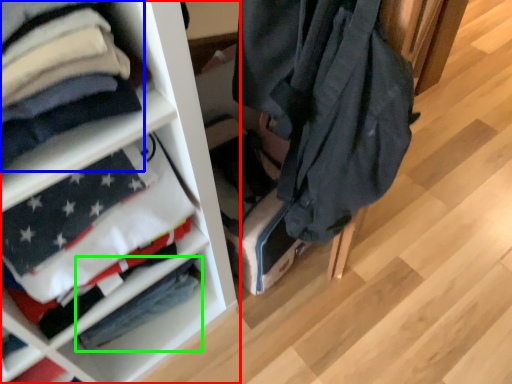
Question: Considering the real-world distances, which object is closest to shelf (highlighted by a red box)? cloak (highlighted by a blue box) or flag (highlighted by a green box).

Choices:
 (A) cloak
 (B) flag

Answer: (B)